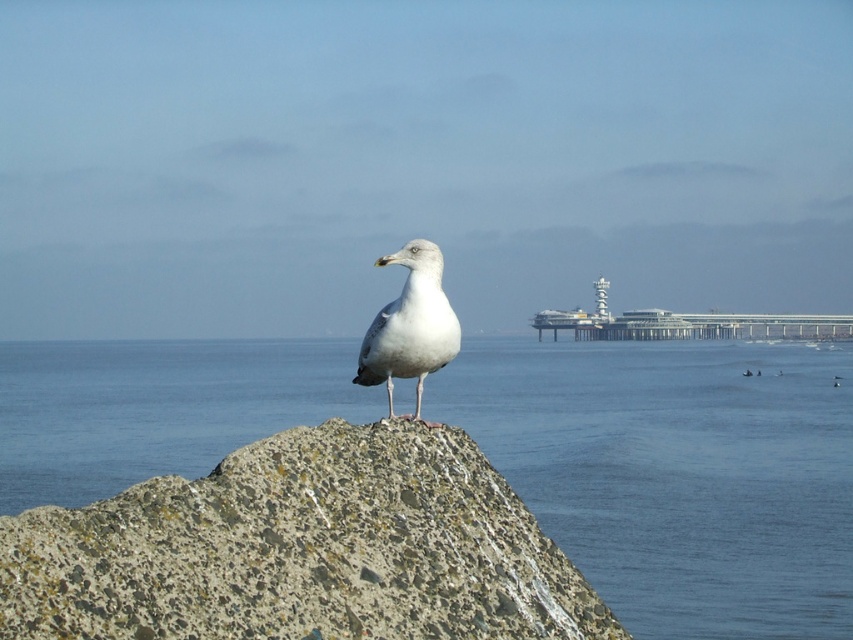
Question: Is blue water at center further to camera compared to white feathered bird at center?

Choices:
 (A) yes
 (B) no

Answer: (A)

Question: Does blue water at center have a smaller size compared to white feathered bird at center?

Choices:
 (A) yes
 (B) no

Answer: (B)

Question: Among these objects, which one is farthest from the camera?

Choices:
 (A) white feathered bird at center
 (B) blue water at center

Answer: (B)

Question: Which object is closer to the camera taking this photo?

Choices:
 (A) white feathered bird at center
 (B) blue water at center

Answer: (A)

Question: Is blue water at center below white feathered bird at center?

Choices:
 (A) no
 (B) yes

Answer: (B)